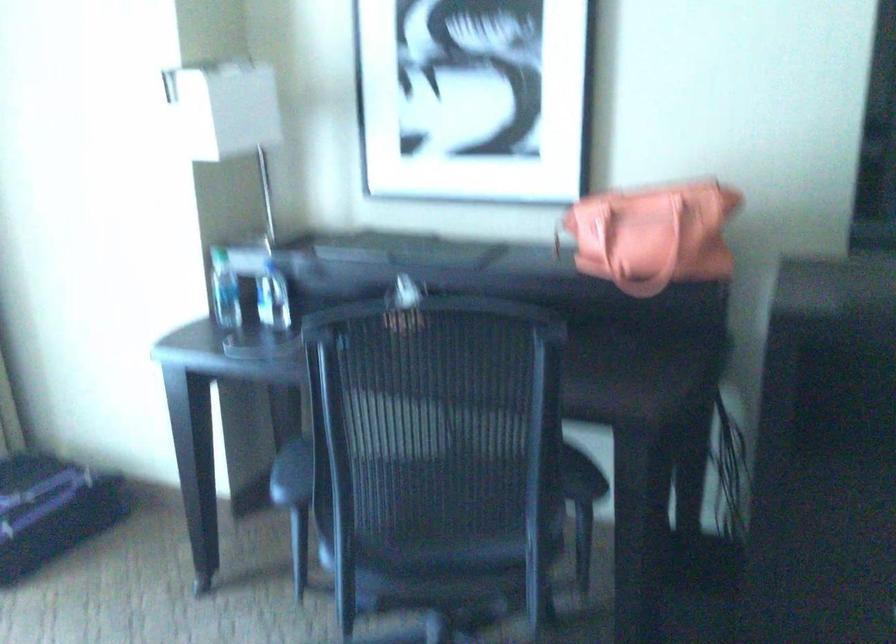
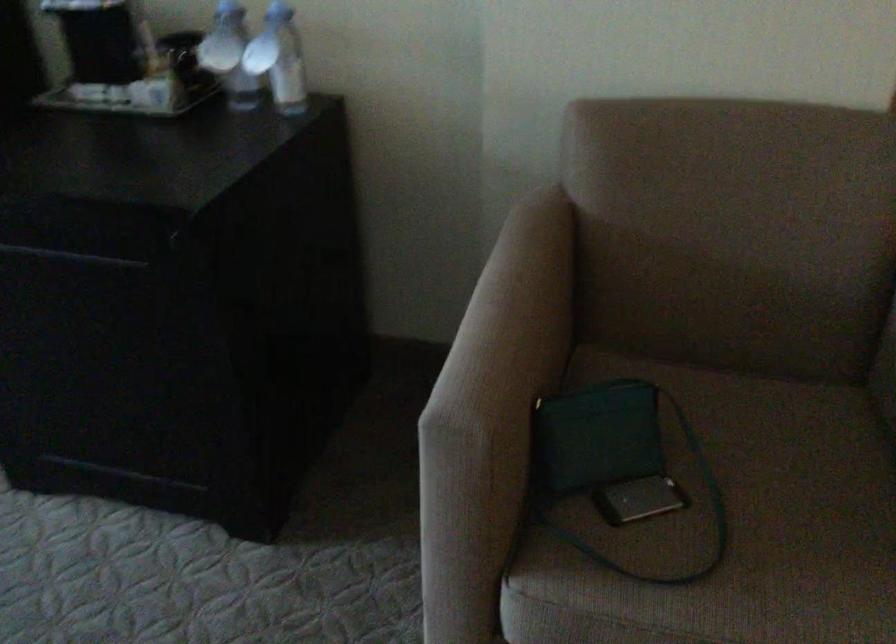
Question: The images are taken continuously from a first-person perspective. In which direction are you moving?

Choices:
 (A) Left
 (B) Right
 (C) Forward
 (D) Backward

Answer: (B)